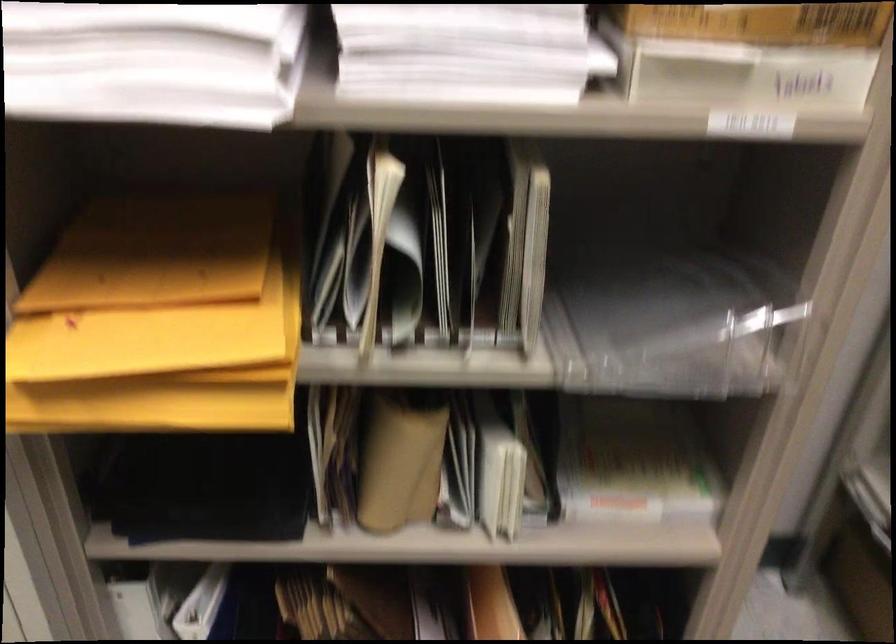
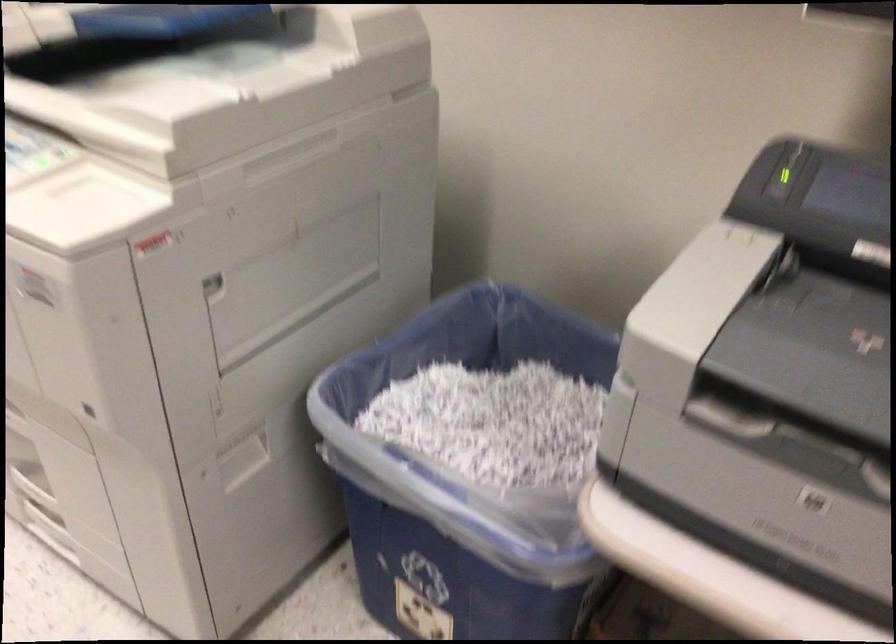
Question: Which direction would the cameraman need to move to produce the second image? Reply with the corresponding letter.

Choices:
 (A) Left
 (B) Right
 (C) Forward
 (D) Backward

Answer: (D)